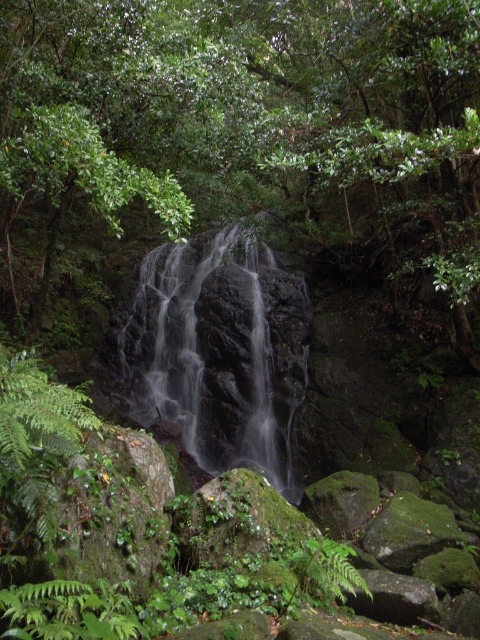
Between green leafy tree at center and translucent glass waterfall at center, which one appears on the left side from the viewer's perspective?

translucent glass waterfall at center

Does green leafy tree at center have a greater height compared to translucent glass waterfall at center?

Indeed, green leafy tree at center has a greater height compared to translucent glass waterfall at center.

The width and height of the screenshot is (480, 640). Find the location of `green leafy tree at center`. green leafy tree at center is located at coordinates (240, 138).

The image size is (480, 640). I want to click on green leafy tree at center, so click(x=240, y=138).